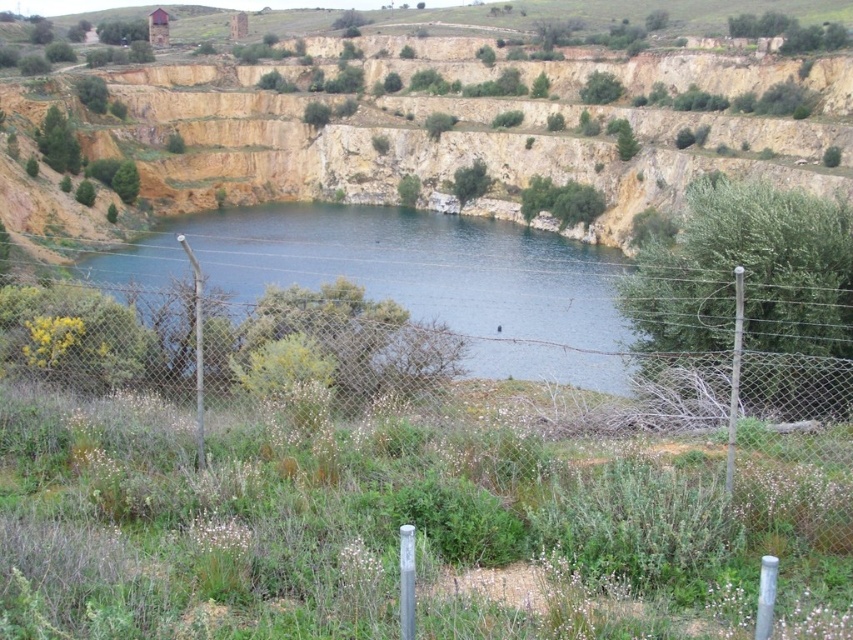
Question: Can you confirm if yellowish rock at center is positioned below wire mesh fence at center?

Choices:
 (A) no
 (B) yes

Answer: (A)

Question: Does yellowish rock at center appear under wire mesh fence at center?

Choices:
 (A) no
 (B) yes

Answer: (A)

Question: Which point is closer to the camera?

Choices:
 (A) yellowish rock at center
 (B) wire mesh fence at center

Answer: (B)

Question: Among these objects, which one is farthest from the camera?

Choices:
 (A) yellowish rock at center
 (B) wire mesh fence at center

Answer: (A)

Question: Does yellowish rock at center have a lesser width compared to wire mesh fence at center?

Choices:
 (A) no
 (B) yes

Answer: (A)